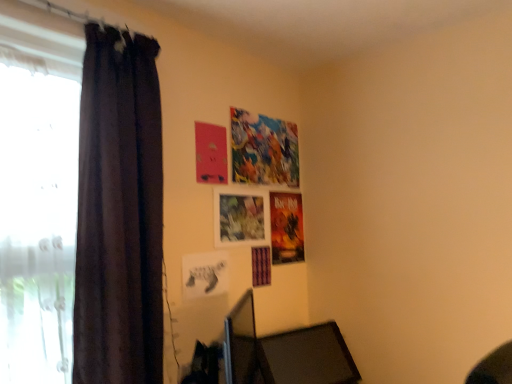
Locate an element on the screen. dark fabric curtain at left is located at coordinates point(106,150).

This screenshot has width=512, height=384. Describe the element at coordinates (106, 150) in the screenshot. I see `dark fabric curtain at left` at that location.

Where is `dark fabric curtain at left`? dark fabric curtain at left is located at coordinates (106, 150).

Does white sheer curtain at left have a greater height compared to black matte picture frame at center?

Correct, white sheer curtain at left is much taller as black matte picture frame at center.

Would you consider white sheer curtain at left to be distant from black matte picture frame at center?

No, white sheer curtain at left is not far from black matte picture frame at center.

From a real-world perspective, which is physically below, white sheer curtain at left or black matte picture frame at center?

black matte picture frame at center is physically lower.

Is point (36, 257) more distant than point (210, 288)?

No.

What's the angular difference between black matte picture frame at center and white sheer curtain at left's facing directions?

black matte picture frame at center and white sheer curtain at left are facing 0.0141 degrees away from each other.

Does black matte picture frame at center have a lesser width compared to white sheer curtain at left?

Correct, the width of black matte picture frame at center is less than that of white sheer curtain at left.

Looking at this image, from a real-world perspective, is black matte picture frame at center under white sheer curtain at left?

Yes, from a real-world perspective, black matte picture frame at center is below white sheer curtain at left.

From the image's perspective, is black matte picture frame at center positioned above or below white sheer curtain at left?

From the image's perspective, black matte picture frame at center appears below white sheer curtain at left.

Which object is thinner, dark fabric curtain at left or white sheer curtain at left?

dark fabric curtain at left.

Does dark fabric curtain at left contain white sheer curtain at left?

No, white sheer curtain at left is located outside of dark fabric curtain at left.

Looking at this image, is dark fabric curtain at left facing towards white sheer curtain at left?

Yes, dark fabric curtain at left faces towards white sheer curtain at left.

Considering the positions of objects dark fabric curtain at left and white sheer curtain at left in the image provided, who is more to the right, dark fabric curtain at left or white sheer curtain at left?

dark fabric curtain at left is more to the right.

Which object is closer to the camera, matte paper poster at upper center or black matte picture frame at center?

black matte picture frame at center is in front.

Is matte paper poster at upper center oriented away from black matte picture frame at center?

No, black matte picture frame at center is not at the back of matte paper poster at upper center.

From the image's perspective, would you say matte paper poster at upper center is positioned over black matte picture frame at center?

Yes, from the image's perspective, matte paper poster at upper center is over black matte picture frame at center.

Is dark fabric curtain at left looking in the opposite direction of black matte picture frame at center?

dark fabric curtain at left does not have its back to black matte picture frame at center.

Is dark fabric curtain at left situated inside black matte picture frame at center or outside?

dark fabric curtain at left exists outside the volume of black matte picture frame at center.

Considering the sizes of objects dark fabric curtain at left and black matte picture frame at center in the image provided, who is taller, dark fabric curtain at left or black matte picture frame at center?

Standing taller between the two is dark fabric curtain at left.

Considering the sizes of objects white sheer curtain at left and matte paper poster at upper center in the image provided, who is bigger, white sheer curtain at left or matte paper poster at upper center?

With larger size is white sheer curtain at left.

Which is more to the right, white sheer curtain at left or matte paper poster at upper center?

matte paper poster at upper center.

Which object is thinner, white sheer curtain at left or matte paper poster at upper center?

With smaller width is matte paper poster at upper center.

Is point (3, 209) in front of point (214, 178)?

Yes, it is in front of point (214, 178).

Identify the location of poster page that is above the black matte picture frame at center (from a real-world perspective). (211, 153).

Is black matte picture frame at center turned away from matte paper poster at upper center?

black matte picture frame at center does not have its back to matte paper poster at upper center.

Is black matte picture frame at center far away from matte paper poster at upper center?

black matte picture frame at center is near matte paper poster at upper center, not far away.

Which of these two, black matte picture frame at center or matte paper poster at upper center, is bigger?

black matte picture frame at center is bigger.

Locate an element on the screen. picture frame lying behind the white sheer curtain at left is located at coordinates (204, 274).

Find the location of a particular element. The image size is (512, 384). window that appears in front of the black matte picture frame at center is located at coordinates (37, 220).

Based on their spatial positions, is black matte picture frame at center or white sheer curtain at left further from dark fabric curtain at left?

Among the two, black matte picture frame at center is located further to dark fabric curtain at left.

When comparing their distances from dark fabric curtain at left, does black matte picture frame at center or matte paper poster at upper center seem further?

Based on the image, black matte picture frame at center appears to be further to dark fabric curtain at left.

Considering their positions, is dark fabric curtain at left positioned further to black matte picture frame at center than matte paper poster at upper center?

The object further to black matte picture frame at center is dark fabric curtain at left.

Looking at the image, which one is located closer to white sheer curtain at left, black matte picture frame at center or dark fabric curtain at left?

Based on the image, dark fabric curtain at left appears to be nearer to white sheer curtain at left.

Looking at the image, which one is located further to black matte picture frame at center, dark fabric curtain at left or white sheer curtain at left?

white sheer curtain at left lies further to black matte picture frame at center than the other object.

Based on their spatial positions, is matte paper poster at upper center or black matte picture frame at center further from dark fabric curtain at left?

Among the two, black matte picture frame at center is located further to dark fabric curtain at left.

Estimate the real-world distances between objects in this image. Which object is closer to dark fabric curtain at left, white sheer curtain at left or matte paper poster at upper center?

white sheer curtain at left lies closer to dark fabric curtain at left than the other object.

Looking at the image, which one is located further to white sheer curtain at left, dark fabric curtain at left or black matte picture frame at center?

black matte picture frame at center lies further to white sheer curtain at left than the other object.

At what (x,y) coordinates should I click in order to perform the action: click on picture frame located between white sheer curtain at left and matte paper poster at upper center in the depth direction. Please return your answer as a coordinate pair (x, y). The width and height of the screenshot is (512, 384). Looking at the image, I should click on (204, 274).

Where is `picture frame between dark fabric curtain at left and matte paper poster at upper center from front to back`? The image size is (512, 384). picture frame between dark fabric curtain at left and matte paper poster at upper center from front to back is located at coordinates (204, 274).

Locate an element on the screen. curtain between white sheer curtain at left and black matte picture frame at center from front to back is located at coordinates (106, 150).

What are the coordinates of `curtain between white sheer curtain at left and matte paper poster at upper center from front to back` in the screenshot? It's located at (106, 150).